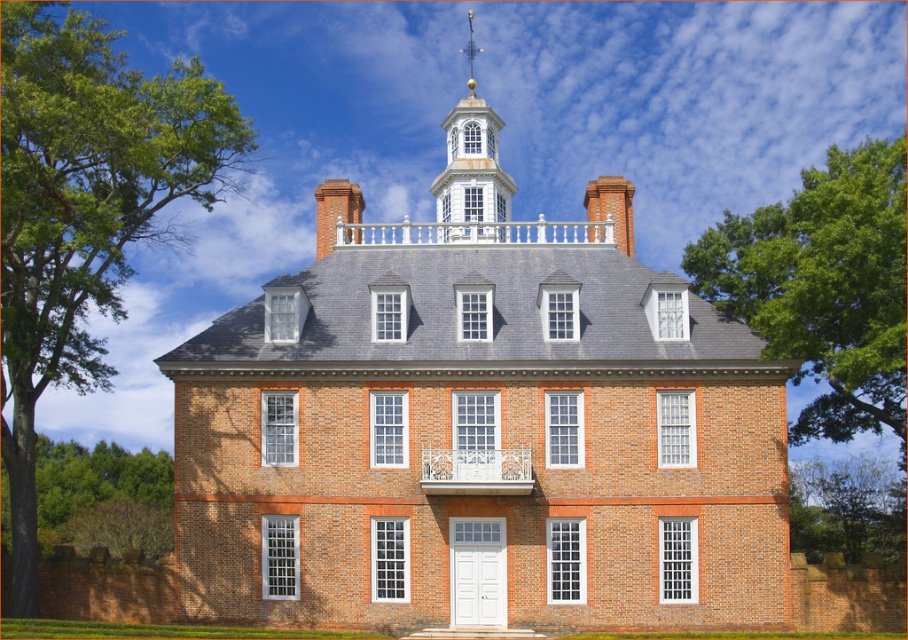
Question: Is green leafy tree at left to the right of green leafy tree at lower right from the viewer's perspective?

Choices:
 (A) no
 (B) yes

Answer: (A)

Question: Which point is farther to the camera?

Choices:
 (A) green leafy tree at left
 (B) green leafy tree at lower right
 (C) green leafy tree at upper right

Answer: (B)

Question: Which object is closer to the camera taking this photo?

Choices:
 (A) green leafy tree at left
 (B) green leafy tree at lower right

Answer: (A)

Question: Does green leafy tree at left have a greater width compared to green leafy tree at lower right?

Choices:
 (A) no
 (B) yes

Answer: (B)

Question: Can you confirm if green leafy tree at left is positioned to the right of green leafy tree at upper right?

Choices:
 (A) yes
 (B) no

Answer: (B)

Question: Which point is farther to the camera?

Choices:
 (A) green leafy tree at lower right
 (B) green leafy tree at left

Answer: (A)